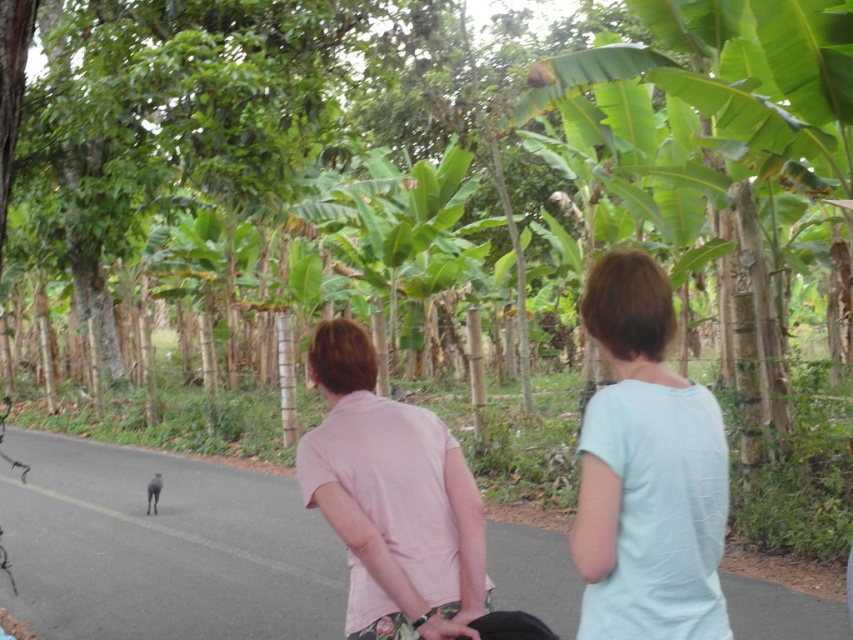
Which of these two, light blue cotton shirt at center or smooth skin hand at center, stands taller?

light blue cotton shirt at center is taller.

From the picture: Which of these two, light blue cotton shirt at center or smooth skin hand at center, stands shorter?

smooth skin hand at center

Is point (660, 304) positioned behind point (442, 634)?

No.

At what (x,y) coordinates should I click in order to perform the action: click on light blue cotton shirt at center. Please return your answer as a coordinate pair (x, y). The width and height of the screenshot is (853, 640). Looking at the image, I should click on (647, 472).

Who is more distant from viewer, (454, 484) or (474, 632)?

The point (454, 484) is more distant.

Can you confirm if pink cotton shirt at center is bigger than smooth skin hand at center?

Indeed, pink cotton shirt at center has a larger size compared to smooth skin hand at center.

This screenshot has width=853, height=640. Identify the location of pink cotton shirt at center. (390, 493).

Locate an element on the screen. This screenshot has width=853, height=640. pink cotton shirt at center is located at coordinates (390, 493).

Is light blue cotton shirt at center taller than pink cotton shirt at center?

Yes.

Is light blue cotton shirt at center smaller than pink cotton shirt at center?

Yes.

Where is `light blue cotton shirt at center`? This screenshot has width=853, height=640. light blue cotton shirt at center is located at coordinates (647, 472).

This screenshot has width=853, height=640. Find the location of `light blue cotton shirt at center`. light blue cotton shirt at center is located at coordinates (647, 472).